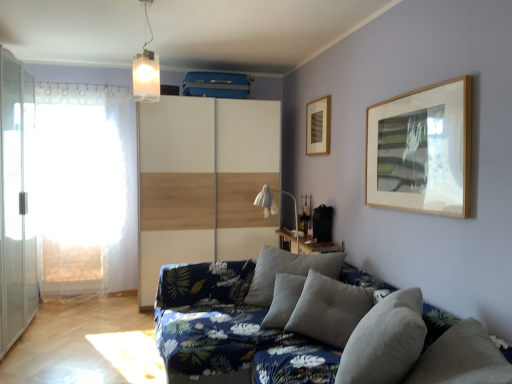
Question: Is point (266, 211) positioned closer to the camera than point (306, 249)?

Choices:
 (A) farther
 (B) closer

Answer: (A)

Question: Is white fabric table lamp at center to the left or to the right of wooden table at center in the image?

Choices:
 (A) left
 (B) right

Answer: (A)

Question: Estimate the real-world distances between objects in this image. Which object is closer to the wooden table at center?

Choices:
 (A) white fabric table lamp at center
 (B) gray fabric pillow at lower right
 (C) wooden picture frame at upper center
 (D) textured gray cushions at lower right
 (E) white lace curtain at left

Answer: (A)

Question: Considering the real-world distances, which object is closest to the wooden table at center?

Choices:
 (A) white lace curtain at left
 (B) transparent glass screen door at left
 (C) textured gray cushions at lower right
 (D) wooden picture frame at upper center
 (E) gray fabric pillow at lower right

Answer: (C)